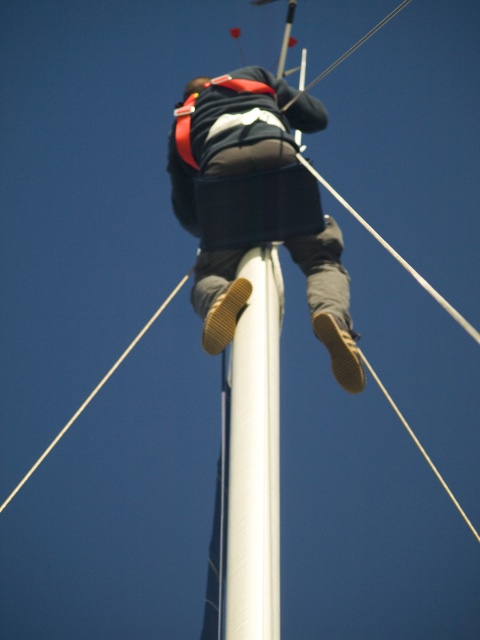
In the scene shown: You are observing a person working on a boat. You notice the matte black jacket at center and the white smooth pole at center. Which object is positioned higher in the image?

The matte black jacket at center is located above the white smooth pole at center, so it is positioned higher in the image.

You are observing a person climbing a pole on a boat. You notice a matte black jacket at center and a white smooth pole at center. Which object is located to the left when viewed from the front?

The matte black jacket at center is positioned on the left side of the white smooth pole at center, so the matte black jacket at center is to the left when viewed from the front.

Looking at this image, you are a safety inspector assessing the scene. The person is working at height on a boat mast. The required safety distance for harness inspection is 10 meters. Is the matte black jacket at center within the safe distance for harness inspection?

The matte black jacket at center is 9.61 meters away from the camera, which is within the 10 meters safety distance requirement. Therefore, the harness inspection can be conducted safely at this distance.